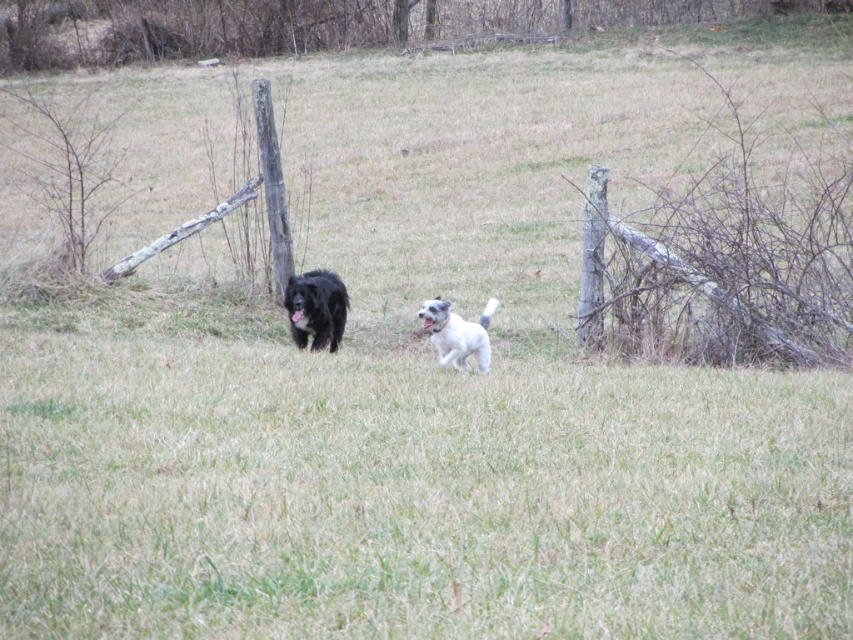
Which is more to the right, black fluffy dog at center or white fluffy dog at center?

Positioned to the right is white fluffy dog at center.

Is black fluffy dog at center positioned in front of white fluffy dog at center?

No, black fluffy dog at center is behind white fluffy dog at center.

Does point (322, 342) come in front of point (465, 356)?

No.

Where is `black fluffy dog at center`? black fluffy dog at center is located at coordinates (316, 308).